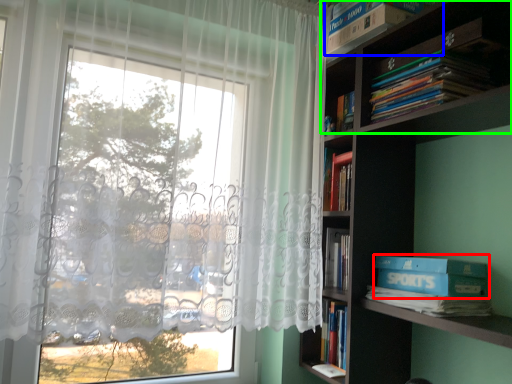
Question: Which object is the farthest from paperback book (highlighted by a red box)? Choose among these: book (highlighted by a blue box) or shelf (highlighted by a green box).

Choices:
 (A) book
 (B) shelf

Answer: (A)